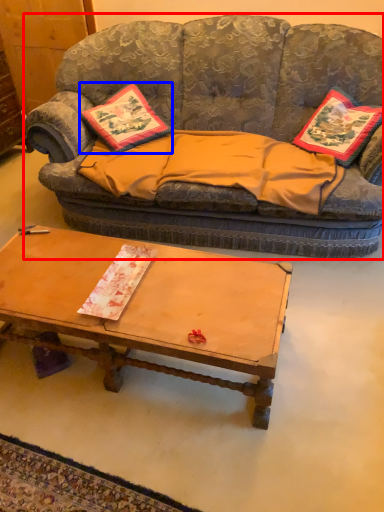
Question: Among these objects, which one is nearest to the camera, studio couch (highlighted by a red box) or pillow (highlighted by a blue box)?

Choices:
 (A) studio couch
 (B) pillow

Answer: (A)